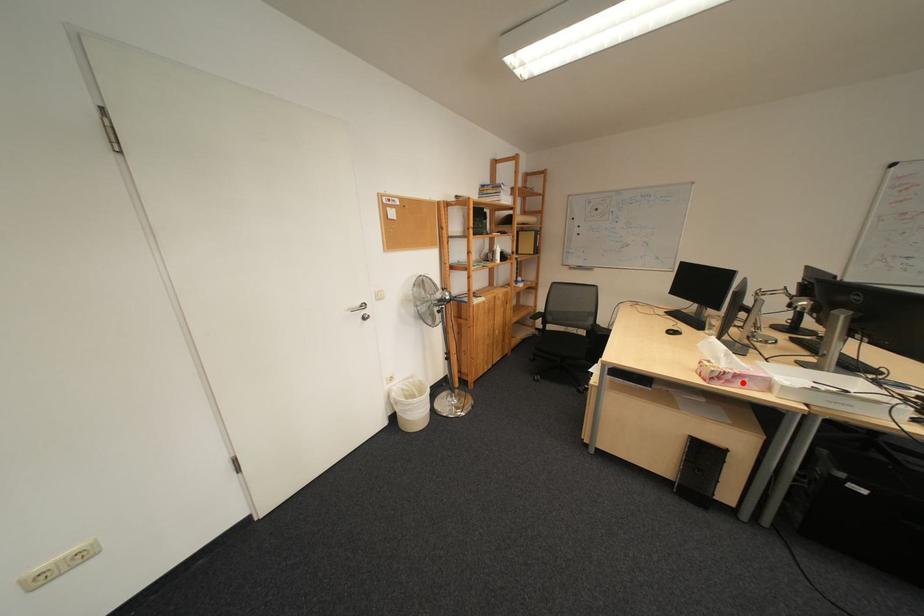
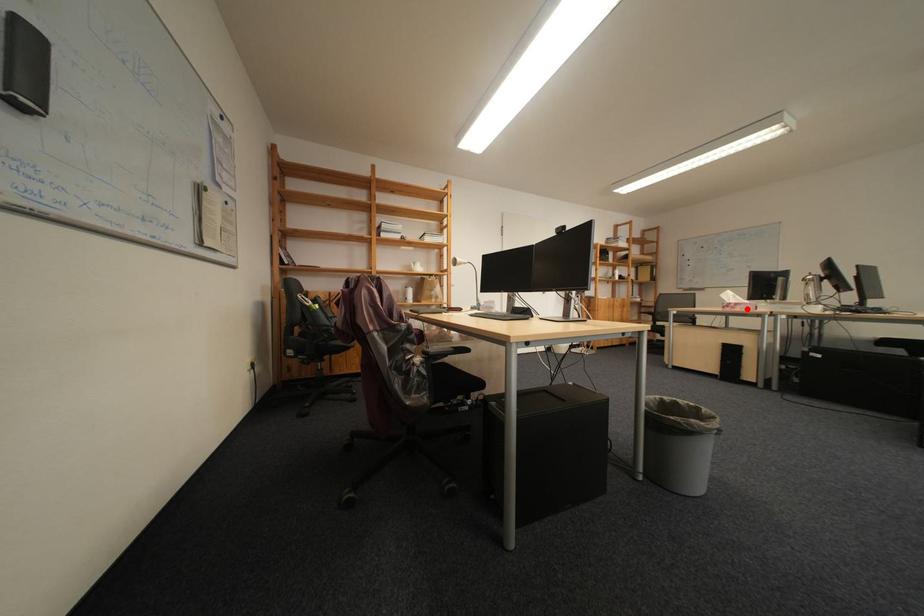
I am providing you with two images of the same scene from different viewpoints. A red point is marked on the first image and another point is marked on the second image. Does the point marked in image1 correspond to the same location as the one in image2?

Yes